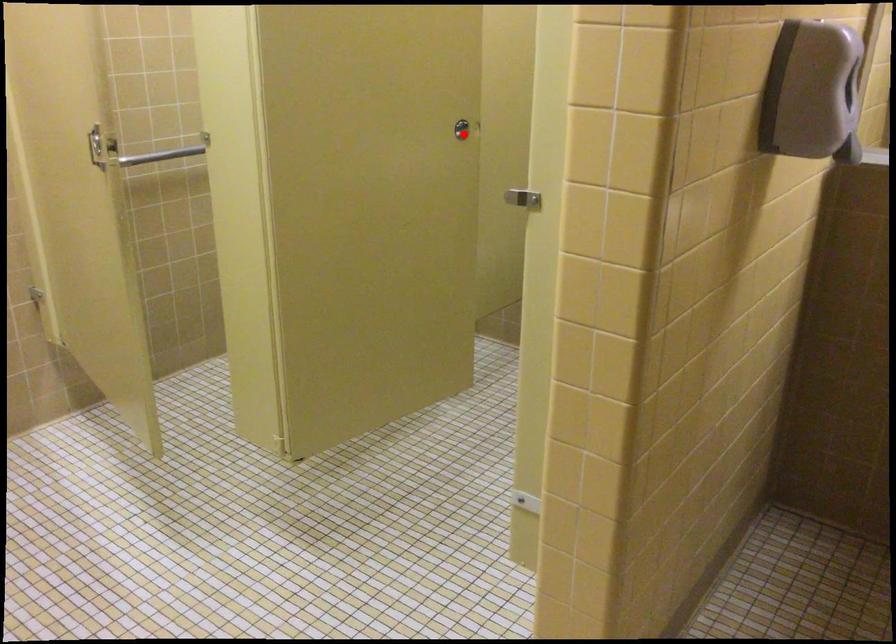
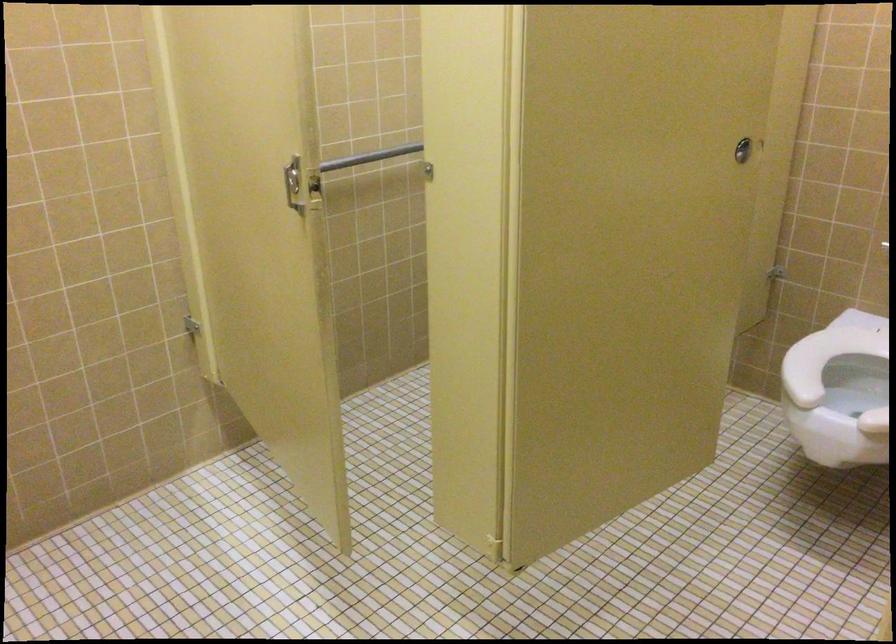
Question: I am providing you with two images of the same scene from different viewpoints. Image1 has a red point marked. In image2, the corresponding 3D location appears at what relative position? Reply with the corresponding letter.

Choices:
 (A) Closer
 (B) Farther

Answer: (A)